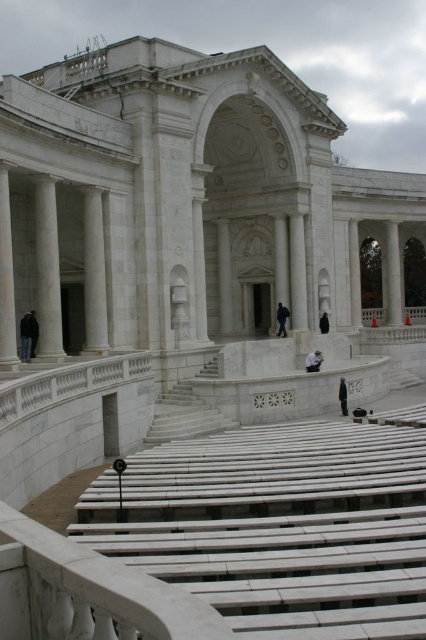
Does white marble column at left appear on the left side of black fabric jacket at lower center?

Incorrect, white marble column at left is not on the left side of black fabric jacket at lower center.

Who is positioned more to the right, white marble column at left or black fabric jacket at lower center?

white marble column at left

Is point (43, 216) positioned behind point (32, 328)?

No, it is not.

This screenshot has width=426, height=640. Find the location of `white marble column at left`. white marble column at left is located at coordinates (48, 269).

Between white marble column at center and black fabric jacket at lower center, which one is positioned higher?

white marble column at center is higher up.

Measure the distance between white marble column at center and black fabric jacket at lower center.

white marble column at center is 6.10 meters from black fabric jacket at lower center.

Who is more forward, (89, 291) or (22, 339)?

Point (22, 339)

This screenshot has height=640, width=426. Find the location of `white marble column at center`. white marble column at center is located at coordinates (94, 273).

Is point (94, 252) positioned before point (327, 323)?

Yes, it is.

Who is more forward, (86, 188) or (328, 324)?

Positioned in front is point (86, 188).

Is point (100, 224) positioned in front of point (324, 312)?

Yes.

This screenshot has height=640, width=426. Identify the location of white marble column at center. tap(94, 273).